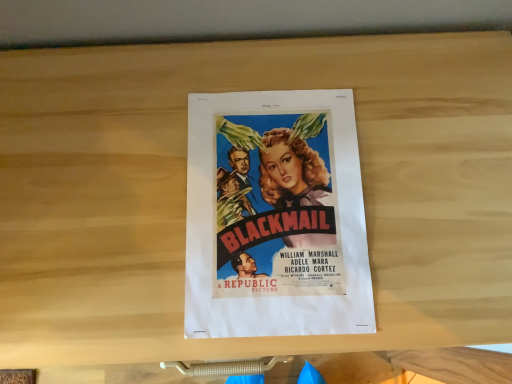
At what (x,y) coordinates should I click in order to perform the action: click on vacant region to the left of matte paper poster at center. Please return your answer as a coordinate pair (x, y). The width and height of the screenshot is (512, 384). Looking at the image, I should click on (101, 200).